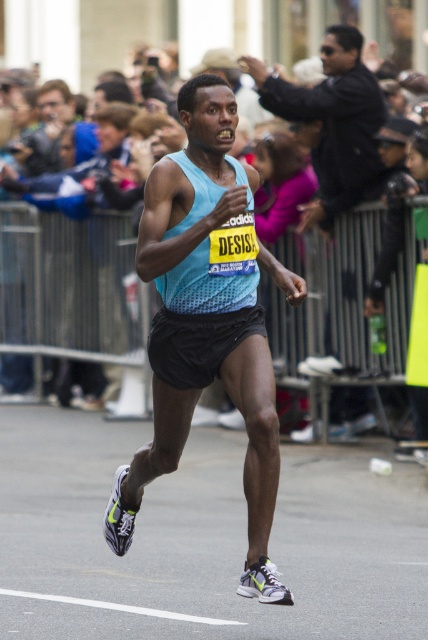
How distant is light blue fabric tank top at center from matte blue tank top at center?

light blue fabric tank top at center and matte blue tank top at center are 5.75 meters apart from each other.

Which is in front, point (196, 292) or point (353, 195)?

Positioned in front is point (196, 292).

The width and height of the screenshot is (428, 640). Identify the location of light blue fabric tank top at center. (207, 320).

Which of these two, matte blue tank top at center or dark gray metal fence at center, stands shorter?

dark gray metal fence at center

Does point (303, 93) come closer to viewer compared to point (309, 301)?

Yes.

Where is `matte blue tank top at center`? matte blue tank top at center is located at coordinates (332, 122).

Does point (273, 576) come behind point (282, 202)?

No, (273, 576) is in front of (282, 202).

Is light blue fabric tank top at center thinner than dark gray metal fence at center?

Incorrect, light blue fabric tank top at center's width is not less than dark gray metal fence at center's.

Is point (234, 394) closer to camera compared to point (285, 204)?

Yes, point (234, 394) is in front of point (285, 204).

The width and height of the screenshot is (428, 640). In order to click on light blue fabric tank top at center in this screenshot , I will do `click(207, 320)`.